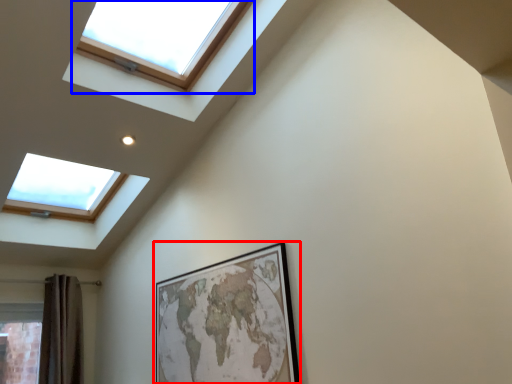
Question: Which of the following is the farthest to the observer, picture frame (highlighted by a red box) or window (highlighted by a blue box)?

Choices:
 (A) picture frame
 (B) window

Answer: (A)